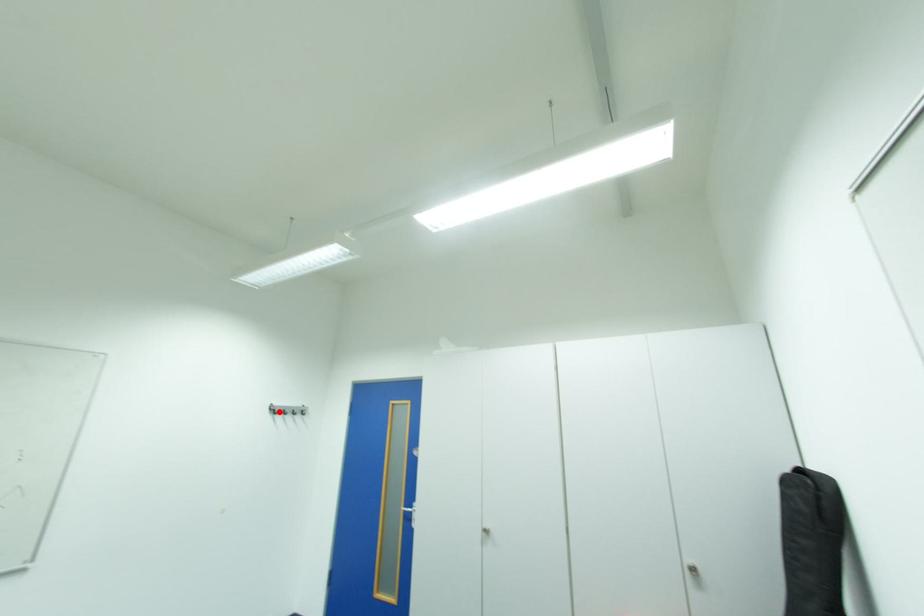
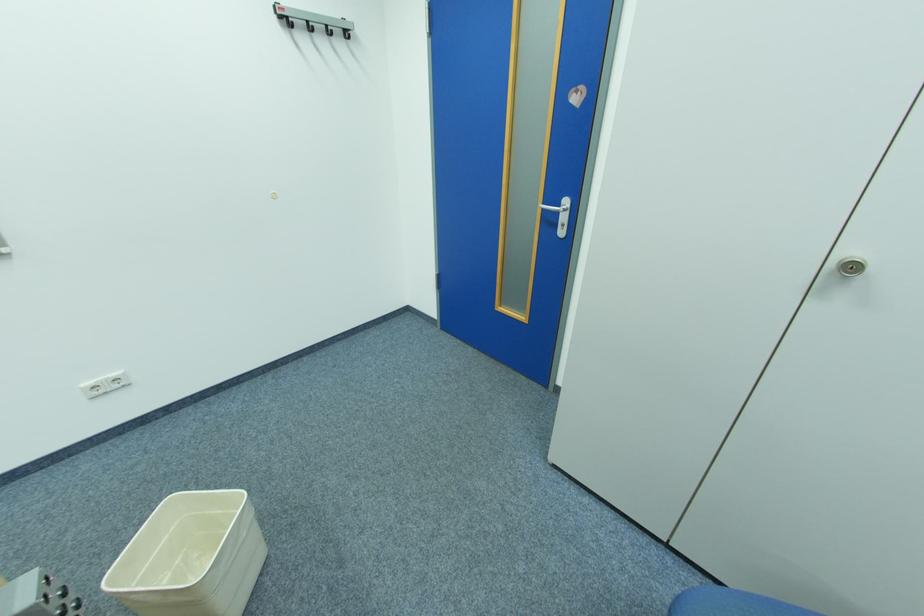
Where in the second image is the point corresponding to the highlighted location from the first image?

(290, 25)